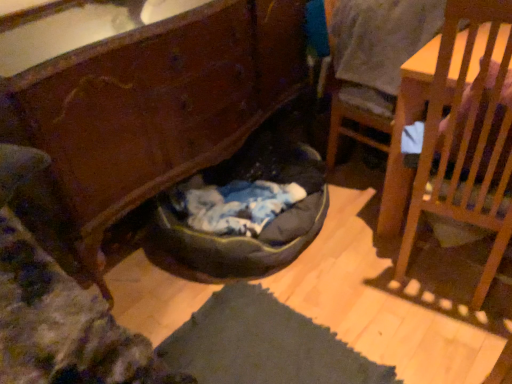
What do you see at coordinates (240, 237) in the screenshot? I see `dark gray fabric bean bag at lower center` at bounding box center [240, 237].

Find the location of `dark gray fabric bean bag at lower center`. dark gray fabric bean bag at lower center is located at coordinates (240, 237).

What is the approximate height of white cotton shirt at upper right?

white cotton shirt at upper right is 12.45 inches tall.

What do you see at coordinates (379, 46) in the screenshot? Image resolution: width=512 pixels, height=384 pixels. I see `white cotton shirt at upper right` at bounding box center [379, 46].

What is the approximate width of wooden chair at right, placed as the second chair when sorted from left to right?

18.05 inches.

This screenshot has height=384, width=512. What do you see at coordinates (377, 49) in the screenshot? I see `wooden chair at right, placed as the first chair when sorted from left to right` at bounding box center [377, 49].

Locate an element on the screen. The image size is (512, 384). wooden cabinet at lower center is located at coordinates (145, 119).

At what (x,y) coordinates should I click in order to perform the action: click on dark gray fabric bean bag at lower center. Please return your answer as a coordinate pair (x, y). This screenshot has width=512, height=384. Looking at the image, I should click on (240, 237).

From the image's perspective, is wooden cabinet at lower center positioned above or below wooden chair at right, marked as the second chair in a right-to-left arrangement?

Based on their image positions, wooden cabinet at lower center is located beneath wooden chair at right, marked as the second chair in a right-to-left arrangement.

How different are the orientations of wooden cabinet at lower center and wooden chair at right, marked as the second chair in a right-to-left arrangement, in degrees?

1.07 degrees separate the facing orientations of wooden cabinet at lower center and wooden chair at right, marked as the second chair in a right-to-left arrangement.

Would you say wooden chair at right, placed as the first chair when sorted from left to right, is part of wooden cabinet at lower center's contents?

No, wooden chair at right, placed as the first chair when sorted from left to right, is not a part of wooden cabinet at lower center.

Between wooden cabinet at lower center and wooden chair at right, marked as the second chair in a right-to-left arrangement, which one has larger size?

wooden cabinet at lower center.

Measure the distance between white cotton shirt at upper right and wooden chair at right, placed as the second chair when sorted from left to right.

The distance of white cotton shirt at upper right from wooden chair at right, placed as the second chair when sorted from left to right, is 18.79 inches.

Is point (333, 49) behind point (467, 74)?

That is True.

From a real-world perspective, is white cotton shirt at upper right physically located above or below wooden chair at right, placed as the second chair when sorted from left to right?

From a real-world perspective, white cotton shirt at upper right is physically above wooden chair at right, placed as the second chair when sorted from left to right.

Is white cotton shirt at upper right not near wooden chair at right, placed as the second chair when sorted from left to right?

No.

Could wooden cabinet at lower center be considered to be inside wooden chair at right, placed as the second chair when sorted from left to right?

Definitely not — wooden cabinet at lower center is not inside wooden chair at right, placed as the second chair when sorted from left to right.

From the image's perspective, is wooden chair at right, the first chair in the right-to-left sequence, located above or below wooden cabinet at lower center?

Clearly, from the image's perspective, wooden chair at right, the first chair in the right-to-left sequence, is below wooden cabinet at lower center.

Does wooden chair at right, the first chair in the right-to-left sequence, have a lesser width compared to wooden cabinet at lower center?

Yes, wooden chair at right, the first chair in the right-to-left sequence, is thinner than wooden cabinet at lower center.

Is wooden chair at right, the first chair in the right-to-left sequence, taller or shorter than wooden cabinet at lower center?

wooden chair at right, the first chair in the right-to-left sequence, is shorter than wooden cabinet at lower center.

Identify the location of bean bag chair below the white cotton shirt at upper right (from the image's perspective). (240, 237).

From the image's perspective, does dark gray fabric bean bag at lower center appear higher than white cotton shirt at upper right?

Actually, dark gray fabric bean bag at lower center appears below white cotton shirt at upper right in the image.

Between dark gray fabric bean bag at lower center and white cotton shirt at upper right, which one has smaller width?

With smaller width is white cotton shirt at upper right.

Considering the positions of point (225, 172) and point (387, 88), is point (225, 172) closer or farther from the camera than point (387, 88)?

Point (225, 172) is positioned farther from the camera compared to point (387, 88).

Are wooden chair at right, the first chair in the right-to-left sequence, and white cotton shirt at upper right far apart?

No, there isn't a large distance between wooden chair at right, the first chair in the right-to-left sequence, and white cotton shirt at upper right.

The width and height of the screenshot is (512, 384). In order to click on clothing above the wooden chair at right, the first chair in the right-to-left sequence (from a real-world perspective) in this screenshot , I will do `click(379, 46)`.

In the scene shown: From the image's perspective, is wooden chair at right, the first chair in the right-to-left sequence, over white cotton shirt at upper right?

No, from the image's perspective, wooden chair at right, the first chair in the right-to-left sequence, is not above white cotton shirt at upper right.

Is wooden cabinet at lower center aimed at white cotton shirt at upper right?

Yes, wooden cabinet at lower center is facing white cotton shirt at upper right.

Choose the correct answer: Is wooden cabinet at lower center inside white cotton shirt at upper right or outside it?

wooden cabinet at lower center exists outside the volume of white cotton shirt at upper right.

From a real-world perspective, which object stands above the other?

white cotton shirt at upper right, from a real-world perspective.

From the image's perspective, which is below, wooden cabinet at lower center or white cotton shirt at upper right?

From the image's view, wooden cabinet at lower center is below.

How many degrees apart are the facing directions of wooden chair at right, marked as the second chair in a right-to-left arrangement, and white cotton shirt at upper right?

There is a 6.24-degree angle between the facing directions of wooden chair at right, marked as the second chair in a right-to-left arrangement, and white cotton shirt at upper right.

Is wooden chair at right, placed as the first chair when sorted from left to right, shorter than white cotton shirt at upper right?

Incorrect, the height of wooden chair at right, placed as the first chair when sorted from left to right, does not fall short of that of white cotton shirt at upper right.

From a real-world perspective, between wooden chair at right, placed as the first chair when sorted from left to right, and white cotton shirt at upper right, who is vertically lower?

wooden chair at right, placed as the first chair when sorted from left to right.

Identify the location of the 1st chair to the right of the wooden cabinet at lower center, counting from the anchor's position. Image resolution: width=512 pixels, height=384 pixels. (377, 49).

The width and height of the screenshot is (512, 384). In order to click on chair located in front of the white cotton shirt at upper right in this screenshot , I will do `click(468, 139)`.

When comparing their distances from wooden cabinet at lower center, does wooden chair at right, placed as the second chair when sorted from left to right, or dark gray fabric bean bag at lower center seem further?

wooden chair at right, placed as the second chair when sorted from left to right, is further to wooden cabinet at lower center.

When comparing their distances from wooden chair at right, placed as the first chair when sorted from left to right, does wooden cabinet at lower center or wooden chair at right, placed as the second chair when sorted from left to right, seem further?

The object further to wooden chair at right, placed as the first chair when sorted from left to right, is wooden cabinet at lower center.

From the image, which object appears to be nearer to dark gray fabric bean bag at lower center, wooden cabinet at lower center or white cotton shirt at upper right?

wooden cabinet at lower center is positioned closer to the anchor dark gray fabric bean bag at lower center.

From the image, which object appears to be farther from white cotton shirt at upper right, dark gray fabric bean bag at lower center or wooden chair at right, placed as the first chair when sorted from left to right?

The object further to white cotton shirt at upper right is dark gray fabric bean bag at lower center.

Which object lies further to the anchor point wooden cabinet at lower center, wooden chair at right, marked as the second chair in a right-to-left arrangement, or wooden chair at right, placed as the second chair when sorted from left to right?

The object further to wooden cabinet at lower center is wooden chair at right, placed as the second chair when sorted from left to right.

Based on their spatial positions, is wooden chair at right, marked as the second chair in a right-to-left arrangement, or white cotton shirt at upper right further from dark gray fabric bean bag at lower center?

white cotton shirt at upper right is positioned further to the anchor dark gray fabric bean bag at lower center.

When comparing their distances from white cotton shirt at upper right, does wooden chair at right, placed as the first chair when sorted from left to right, or wooden cabinet at lower center seem further?

wooden cabinet at lower center is positioned further to the anchor white cotton shirt at upper right.

Considering their positions, is white cotton shirt at upper right positioned closer to wooden chair at right, placed as the first chair when sorted from left to right, than wooden cabinet at lower center?

white cotton shirt at upper right lies closer to wooden chair at right, placed as the first chair when sorted from left to right, than the other object.

Find the location of `clothing between wooden cabinet at lower center and wooden chair at right, the first chair in the right-to-left sequence, from left to right`. clothing between wooden cabinet at lower center and wooden chair at right, the first chair in the right-to-left sequence, from left to right is located at coordinates (379, 46).

Find the location of a particular element. clothing between dark gray fabric bean bag at lower center and wooden chair at right, placed as the second chair when sorted from left to right, in the horizontal direction is located at coordinates pos(379,46).

This screenshot has height=384, width=512. What are the coordinates of `bean bag chair located between wooden cabinet at lower center and wooden chair at right, placed as the first chair when sorted from left to right, in the left-right direction` in the screenshot? It's located at (240, 237).

Image resolution: width=512 pixels, height=384 pixels. Identify the location of bean bag chair between wooden cabinet at lower center and wooden chair at right, the first chair in the right-to-left sequence, in the horizontal direction. (240, 237).